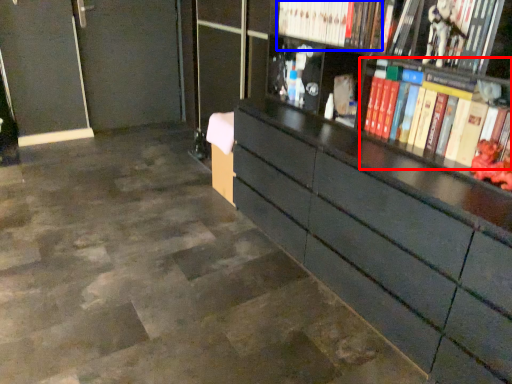
Question: Which object appears farthest to the camera in this image, book (highlighted by a red box) or book (highlighted by a blue box)?

Choices:
 (A) book
 (B) book

Answer: (B)